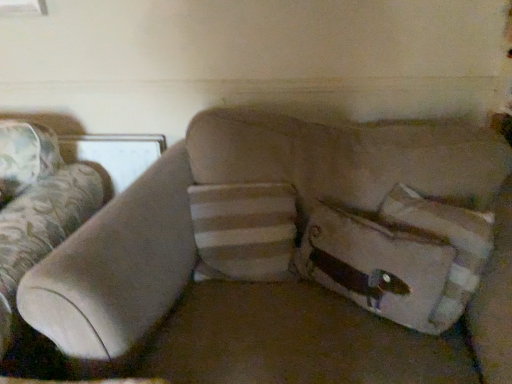
Question: Considering their positions, is white striped pillow at right located in front of or behind suede beige couch at center?

Choices:
 (A) behind
 (B) front

Answer: (A)

Question: In terms of width, does white striped pillow at right look wider or thinner when compared to suede beige couch at center?

Choices:
 (A) wide
 (B) thin

Answer: (B)

Question: From the image's perspective, is white striped pillow at right above or below suede beige couch at center?

Choices:
 (A) above
 (B) below

Answer: (A)

Question: Is suede beige couch at center in front of or behind white striped pillow at right in the image?

Choices:
 (A) behind
 (B) front

Answer: (B)

Question: Do you think suede beige couch at center is within white striped pillow at right, or outside of it?

Choices:
 (A) inside
 (B) outside

Answer: (B)

Question: Considering the positions of suede beige couch at center and white striped pillow at right in the image, is suede beige couch at center taller or shorter than white striped pillow at right?

Choices:
 (A) tall
 (B) short

Answer: (A)

Question: From a real-world perspective, relative to white striped pillow at right, is suede beige couch at center vertically above or below?

Choices:
 (A) above
 (B) below

Answer: (B)